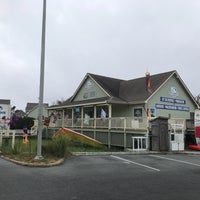
I want to click on chimney, so click(147, 81).